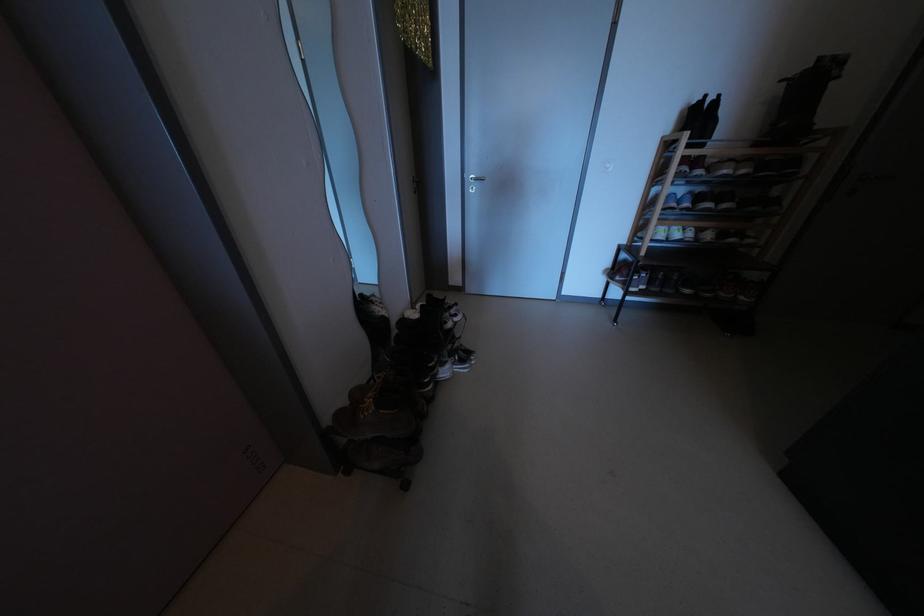
The width and height of the screenshot is (924, 616). I want to click on silver door handle, so click(475, 182).